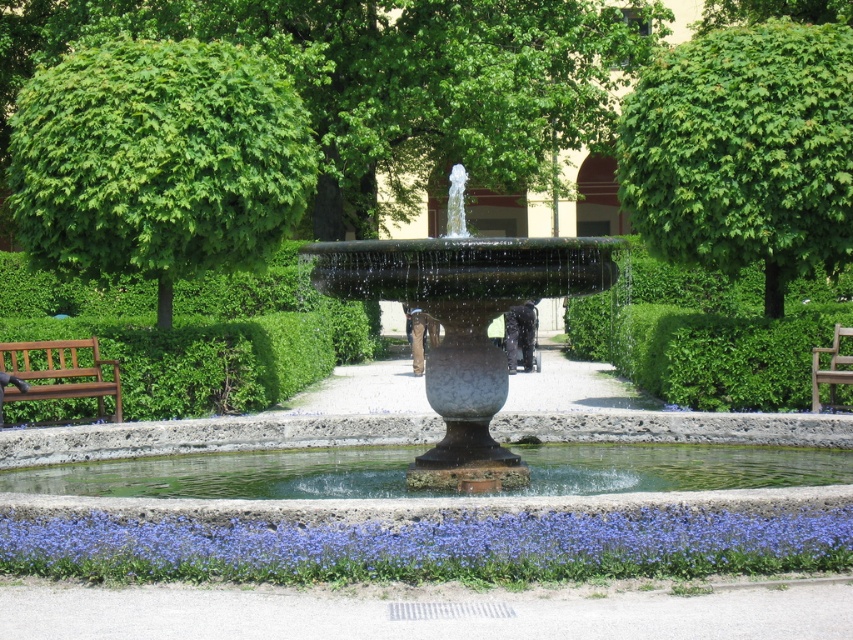
Is point (813, 51) less distant than point (67, 346)?

No, it is not.

Can you confirm if green leafy tree at upper center is positioned to the right of brown wooden bench at left?

Indeed, green leafy tree at upper center is positioned on the right side of brown wooden bench at left.

Is point (807, 84) positioned in front of point (80, 372)?

No, it is not.

Where is `green leafy tree at upper center`? The height and width of the screenshot is (640, 853). green leafy tree at upper center is located at coordinates (744, 150).

Does green leafy tree at upper left appear over blue matte flower at lower center?

Yes.

Which is behind, point (134, 161) or point (180, 529)?

The point (134, 161) is behind.

Locate an element on the screen. This screenshot has height=640, width=853. green leafy tree at upper left is located at coordinates (157, 161).

Is point (201, 522) positioned in front of point (109, 388)?

Yes.

Looking at this image, between blue matte flower at lower center and brown wooden bench at left, which one has more height?

brown wooden bench at left

Measure the distance between blue matte flower at lower center and camera.

8.60 meters

Locate an element on the screen. This screenshot has height=640, width=853. blue matte flower at lower center is located at coordinates click(428, 545).